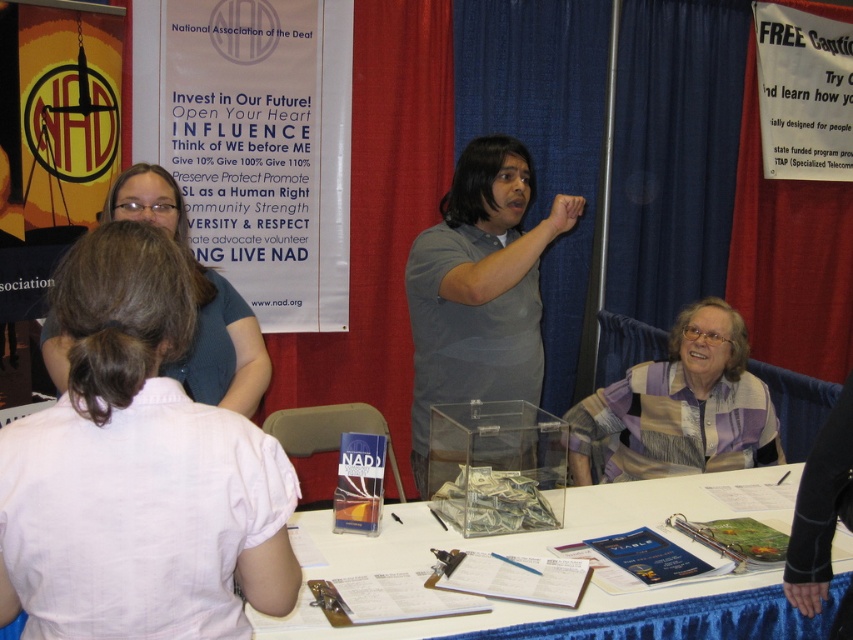
You are attending an event organized by the National Association of the Deaf and notice two people at a table. One is wearing a pink fabric shirt at upper left, and the other is wearing a gray cotton shirt at center. Which person is wearing a smaller shirt?

The pink fabric shirt at upper left is smaller than the gray cotton shirt at center, so the person wearing the pink fabric shirt at upper left has the smaller shirt.

What is located at the coordinates point (479, 288)?

The gray cotton shirt at center is located at point (479, 288).

You are organizing a photo shoot for a clothing brand and need to arrange two models wearing the gray cotton shirt at center and the matte blue shirt at upper left. Based on their current positions and the description provided, which model should you place closer to the camera to create a visual balance?

The gray cotton shirt at center is thinner than the matte blue shirt at upper left, so placing the model wearing the gray cotton shirt at center closer to the camera will help balance their visual sizes since the thinner shirt might appear smaller from a distance.